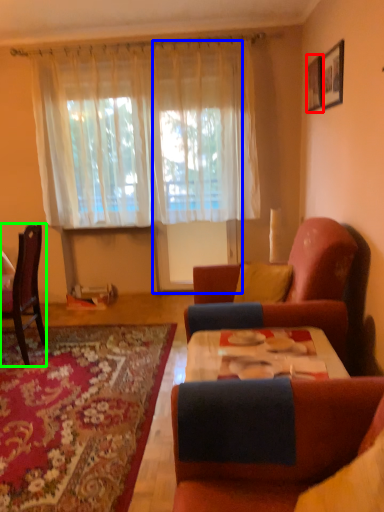
Question: Which is nearer to the picture frame (highlighted by a red box)? glass door (highlighted by a blue box) or chair (highlighted by a green box).

Choices:
 (A) glass door
 (B) chair

Answer: (A)